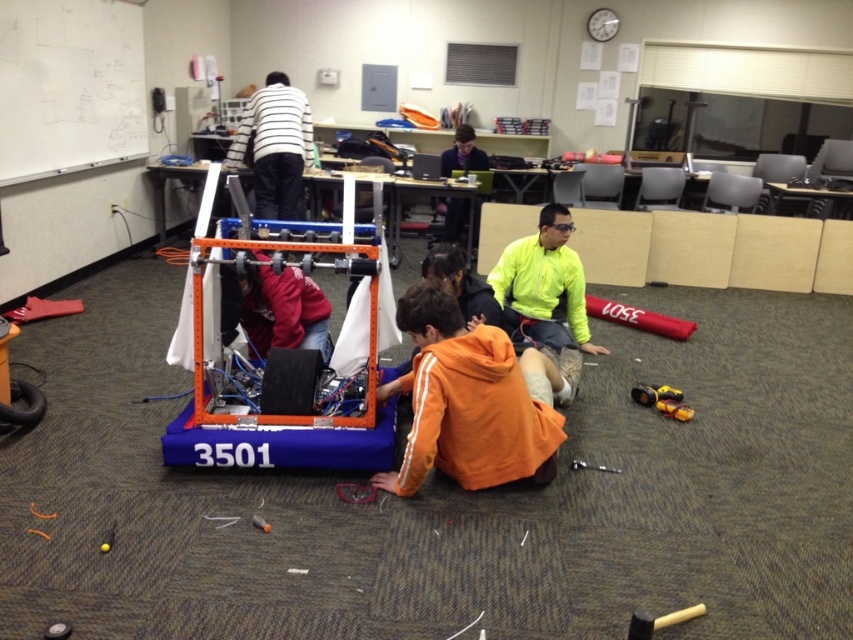
Which of these two, matte red jacket at center or dark blue shirt at center, stands shorter?

Standing shorter between the two is matte red jacket at center.

Does matte red jacket at center appear on the left side of dark blue shirt at center?

Correct, you'll find matte red jacket at center to the left of dark blue shirt at center.

Describe the element at coordinates (282, 310) in the screenshot. The image size is (853, 640). I see `matte red jacket at center` at that location.

Locate an element on the screen. This screenshot has height=640, width=853. matte red jacket at center is located at coordinates (282, 310).

Which is below, orange fleece jacket at lower center or dark blue shirt at center?

orange fleece jacket at lower center

At what (x,y) coordinates should I click in order to perform the action: click on orange fleece jacket at lower center. Please return your answer as a coordinate pair (x, y). The image size is (853, 640). Looking at the image, I should click on (473, 401).

Is black rubber tire at center below dark blue shirt at center?

Yes, black rubber tire at center is below dark blue shirt at center.

Does black rubber tire at center have a lesser height compared to dark blue shirt at center?

Yes.

In order to click on black rubber tire at center in this screenshot , I will do `click(289, 381)`.

I want to click on black rubber tire at center, so click(x=289, y=381).